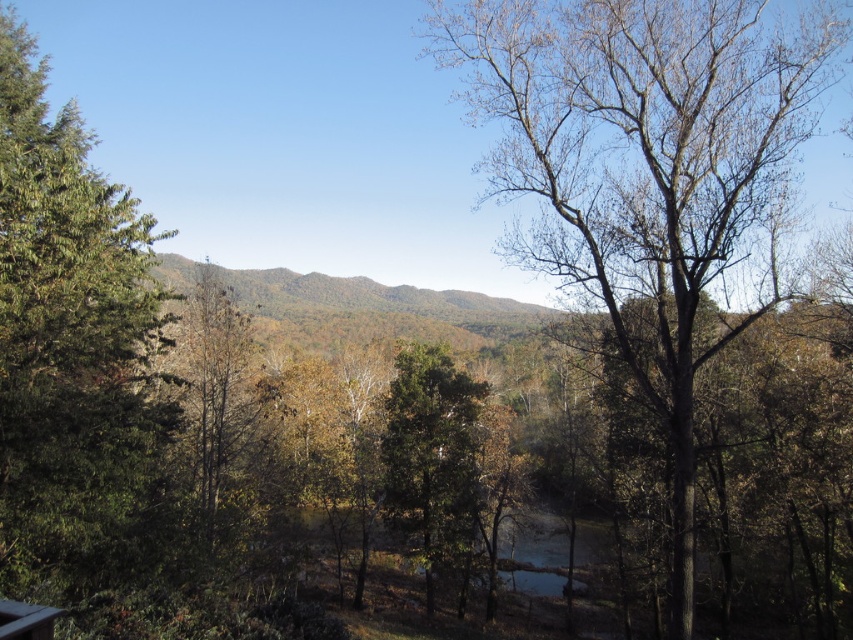
You are standing in the forest and want to take a photo of the bare wood tree at center. If your camera can focus on objects up to 20 meters away, will you be able to capture the tree clearly?

The bare wood tree at center is 17.46 meters away from the viewer, which is within the camera focus range of up to 20 meters. Therefore, you can capture the tree clearly.